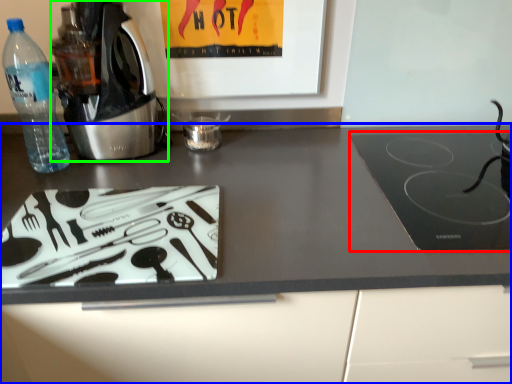
Question: Based on their relative distances, which object is farther from kitchen appliance (highlighted by a red box)? Choose from countertop (highlighted by a blue box) and home appliance (highlighted by a green box).

Choices:
 (A) countertop
 (B) home appliance

Answer: (B)